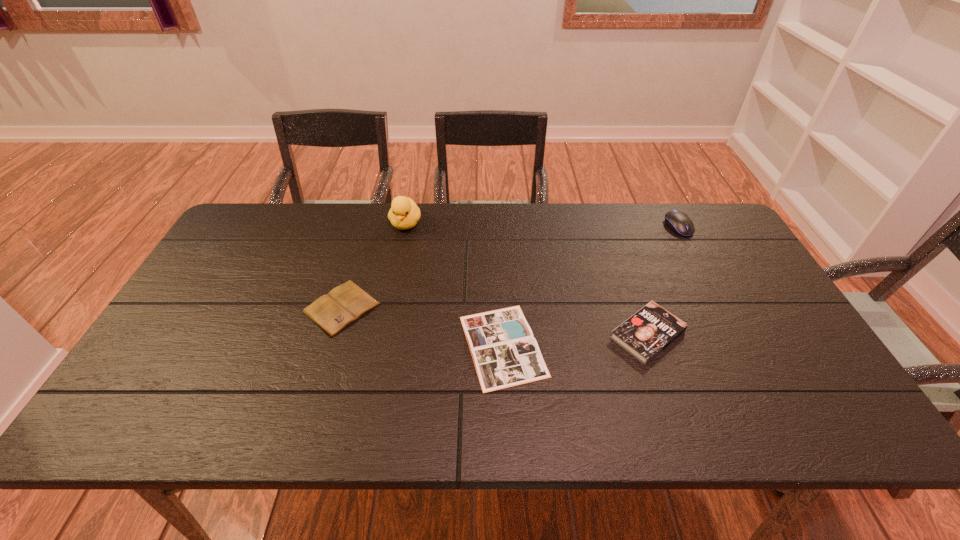
Where is `vacant position located on the back of the leftmost book`? This screenshot has height=540, width=960. vacant position located on the back of the leftmost book is located at coordinates (364, 237).

At what (x,y) coordinates should I click in order to perform the action: click on vacant space located 0.200m on the right of the second book from left to right. Please return your answer as a coordinate pair (x, y). Looking at the image, I should click on (627, 346).

Locate an element on the screen. This screenshot has height=540, width=960. duck that is at the far edge is located at coordinates click(x=404, y=214).

Locate an element on the screen. computer mouse at the far edge is located at coordinates (679, 222).

Where is `object that is positioned at the right edge`? The width and height of the screenshot is (960, 540). object that is positioned at the right edge is located at coordinates (679, 222).

Identify the location of object that is at the far right corner. This screenshot has width=960, height=540. (679, 222).

Image resolution: width=960 pixels, height=540 pixels. In order to click on blank space at the far edge of the desktop in this screenshot , I will do `click(653, 238)`.

The height and width of the screenshot is (540, 960). In the image, there is a desktop. What are the coordinates of `vacant space at the near edge` in the screenshot? It's located at (297, 399).

Locate an element on the screen. This screenshot has width=960, height=540. free space at the left edge of the desktop is located at coordinates (165, 346).

Image resolution: width=960 pixels, height=540 pixels. What are the coordinates of `free space at the right edge of the desktop` in the screenshot? It's located at (781, 315).